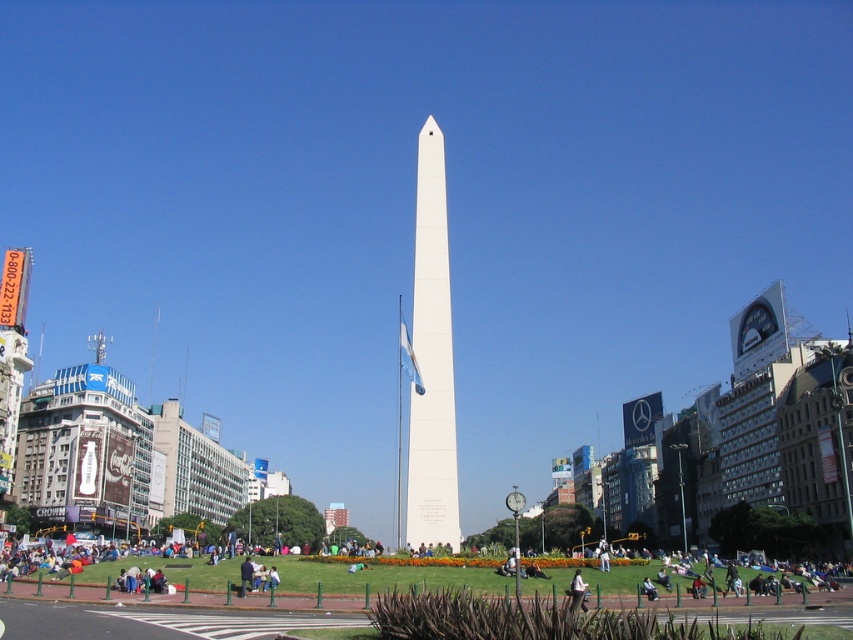
Does white polished stone obelisk at center appear over green grass at lower center?

Yes.

Between white polished stone obelisk at center and green grass at lower center, which one appears on the left side from the viewer's perspective?

Positioned to the left is white polished stone obelisk at center.

Who is more distant from viewer, [434,362] or [624,576]?

The point [434,362] is behind.

This screenshot has width=853, height=640. What are the coordinates of `white polished stone obelisk at center` in the screenshot? It's located at (431, 360).

Could you measure the distance between white polished stone obelisk at center and light brown leather jacket at lower center?

white polished stone obelisk at center is 25.63 meters from light brown leather jacket at lower center.

Is point (416, 547) farther from camera compared to point (583, 588)?

Yes, point (416, 547) is farther from viewer.

Between point (418, 368) and point (583, 580), which one is positioned in front?

Point (583, 580)

Identify the location of white polished stone obelisk at center. The image size is (853, 640). (431, 360).

Is point (279, 589) positioned in front of point (581, 589)?

No, it is not.

Can you confirm if green grass at lower center is thinner than light brown leather jacket at lower center?

No.

Measure the distance between green grass at lower center and camera.

green grass at lower center and camera are 67.05 meters apart from each other.

You are a GUI agent. You are given a task and a screenshot of the screen. Output one action in this format:
    pyautogui.click(x=<x>, y=<y>)
    Task: Click on the green grass at lower center
    Image resolution: width=853 pixels, height=640 pixels.
    Given the screenshot: What is the action you would take?
    tap(375, 576)